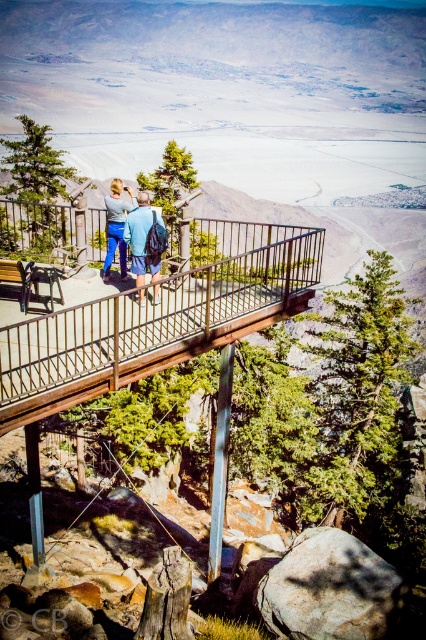
Who is lower down, blue fabric backpack at center or matte blue jeans at center?

Positioned lower is blue fabric backpack at center.

Is point (131, 236) less distant than point (129, 208)?

Yes, point (131, 236) is closer to viewer.

The width and height of the screenshot is (426, 640). Identify the location of blue fabric backpack at center. (129, 234).

Based on the photo, is wooden rail at center above matte blue jeans at center?

Yes, wooden rail at center is above matte blue jeans at center.

Between wooden rail at center and matte blue jeans at center, which one has less height?

matte blue jeans at center

Locate an element on the screen. The width and height of the screenshot is (426, 640). wooden rail at center is located at coordinates (158, 320).

Can you confirm if wooden rail at center is positioned to the right of blue fabric backpack at center?

Correct, you'll find wooden rail at center to the right of blue fabric backpack at center.

Does wooden rail at center come in front of blue fabric backpack at center?

Yes, it is.

This screenshot has height=640, width=426. In order to click on wooden rail at center in this screenshot , I will do `click(158, 320)`.

At what (x,y) coordinates should I click in order to perform the action: click on wooden rail at center. Please return your answer as a coordinate pair (x, y). Looking at the image, I should click on (158, 320).